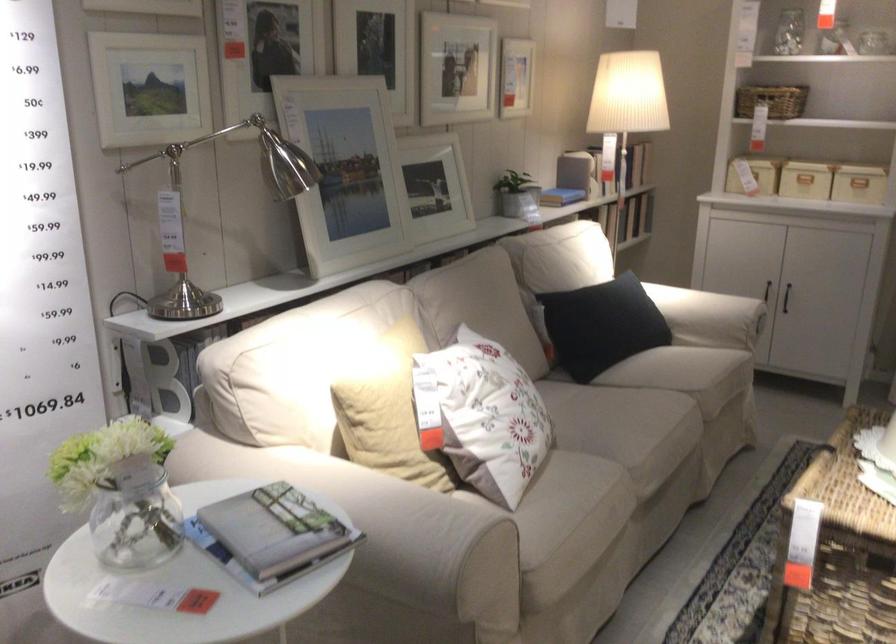
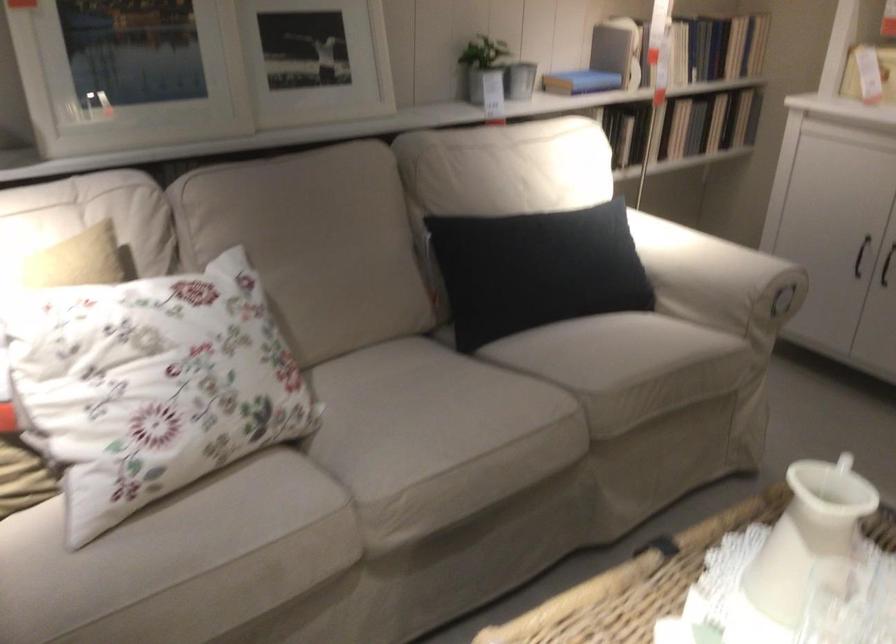
Locate, in the second image, the point that corresponds to [722,307] in the first image.

(717, 279)